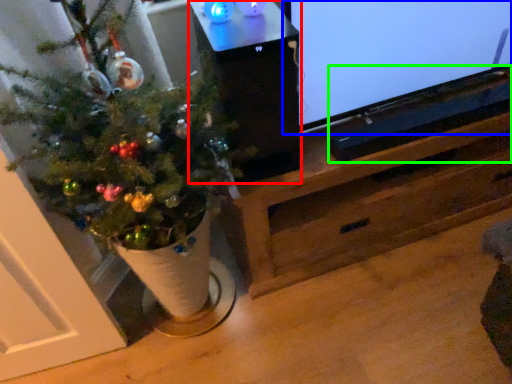
Question: Estimate the real-world distances between objects in this image. Which object is closer to table (highlighted by a red box), television (highlighted by a blue box) or wide (highlighted by a green box)?

Choices:
 (A) television
 (B) wide

Answer: (A)